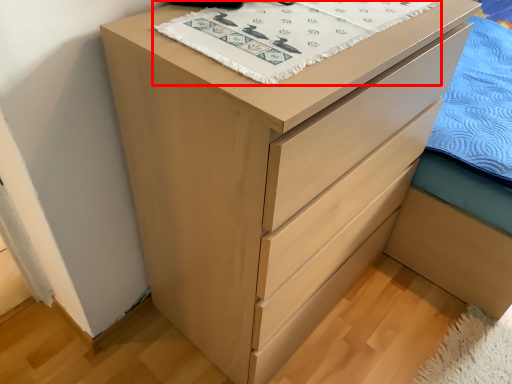
Question: From the image's perspective, considering the relative positions of blanket (annotated by the red box) and bed frame in the image provided, where is blanket (annotated by the red box) located with respect to the staircase?

Choices:
 (A) below
 (B) above

Answer: (A)